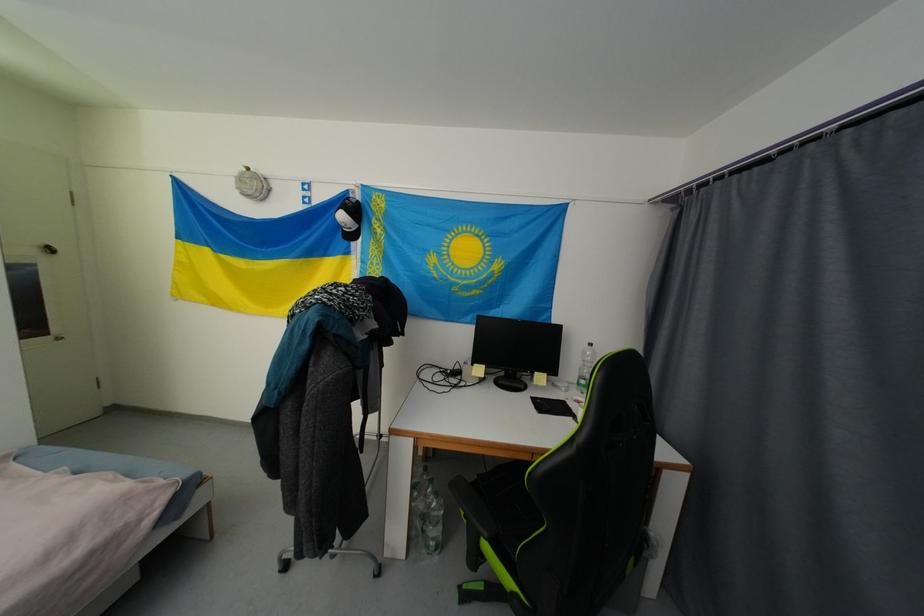
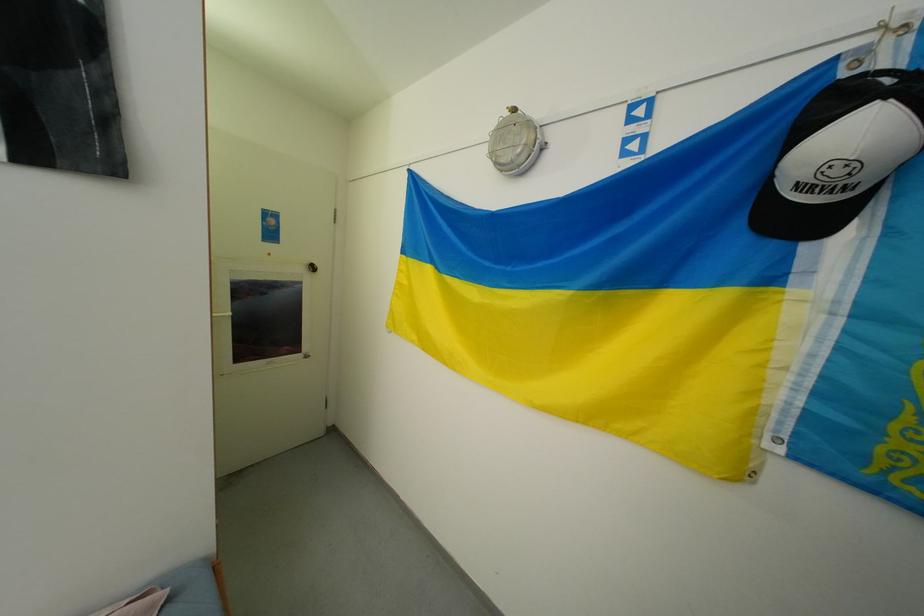
Where in the second image is the point corresponding to point 359,203 from the first image?

(896, 81)